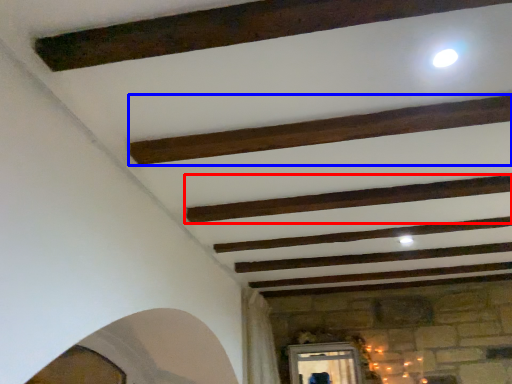
Question: Which object is closer to the camera taking this photo, plank (highlighted by a red box) or plank (highlighted by a blue box)?

Choices:
 (A) plank
 (B) plank

Answer: (B)